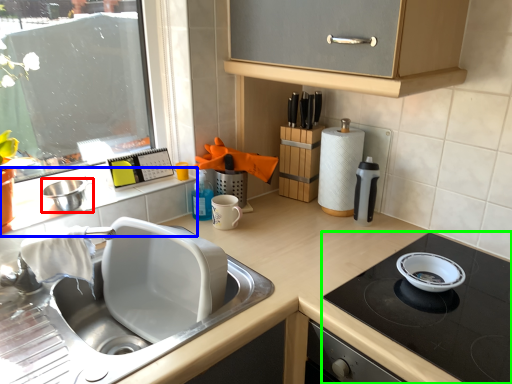
Question: Estimate the real-world distances between objects in this image. Which object is farther from mixing bowl (highlighted by a red box), window sill (highlighted by a blue box) or gas stove (highlighted by a green box)?

Choices:
 (A) window sill
 (B) gas stove

Answer: (B)